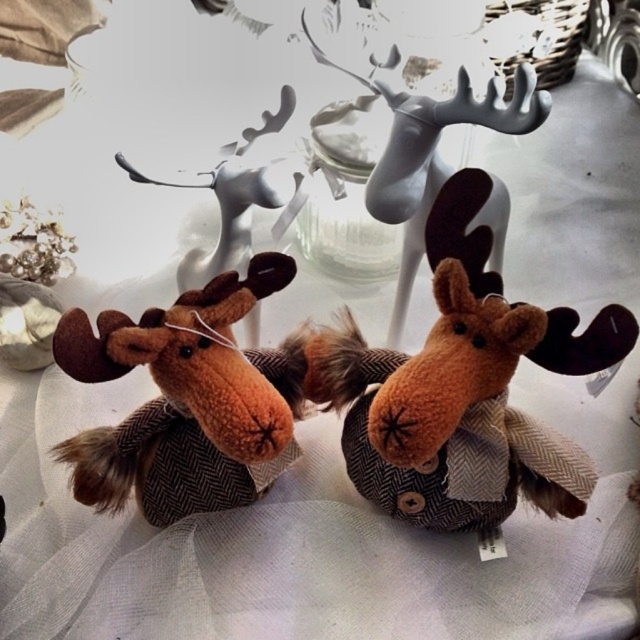
You are trying to place a rectangular box that is 10 cm wide onto the surface where the brown fuzzy moose at center and matte white antlers at upper center are located. Can the box fit between them without overlapping either object?

The brown fuzzy moose at center is wider than the matte white antlers at upper center. However, the exact distance between them isn question. Without knowing the space between them, it is impossible to determine if the 10 cm wide box can fit without overlapping.

You are organizing a display and need to place a new ornament at coordinates point 0.6, 0.3. Will this new ornament interfere with the brown fuzzy moose at center?

The brown fuzzy moose at center is located at point [188,401]. The new ornament at [192,384] is very close but slightly to the left and lower. Depending on the size of the ornament and the moose, there might be interference. However, based on the coordinates alone, they are near but not exactly overlapping. Further details on their sizes would be needed for a definitive answer.

You are organizing a display and need to know which object takes up more space. Looking at the brown fuzzy moose at center and the matte white antlers at upper center, which one requires more space for placement?

The matte white antlers at upper center requires more space for placement because the brown fuzzy moose at center occupies less space than matte white antlers at upper center.